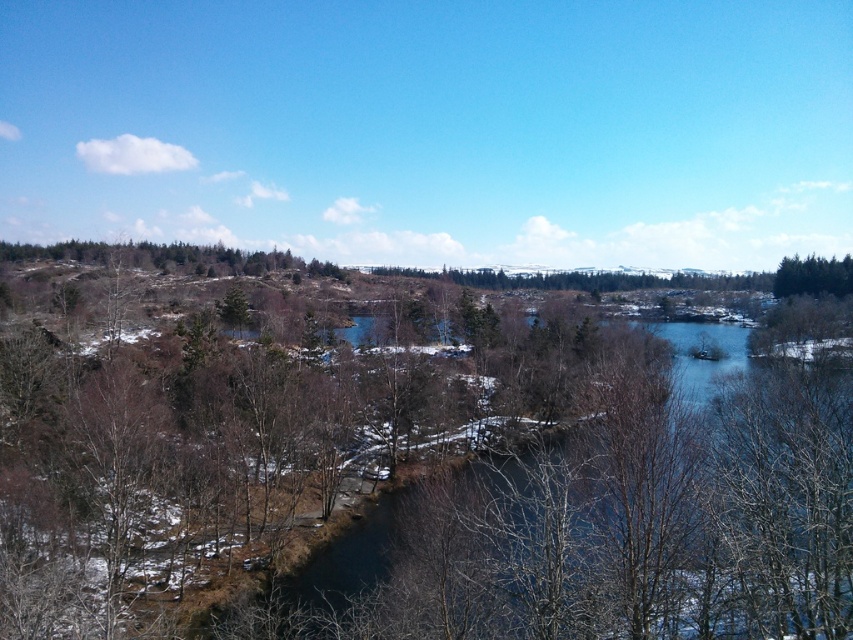
Based on the photo, can you confirm if brown leafless tree at center is positioned below green leafy trees at upper right?

Correct, brown leafless tree at center is located below green leafy trees at upper right.

Is brown leafless tree at center shorter than green leafy trees at upper right?

In fact, brown leafless tree at center may be taller than green leafy trees at upper right.

What do you see at coordinates (426, 483) in the screenshot? The height and width of the screenshot is (640, 853). I see `brown leafless tree at center` at bounding box center [426, 483].

Find the location of a particular element. Image resolution: width=853 pixels, height=640 pixels. brown leafless tree at center is located at coordinates point(426,483).